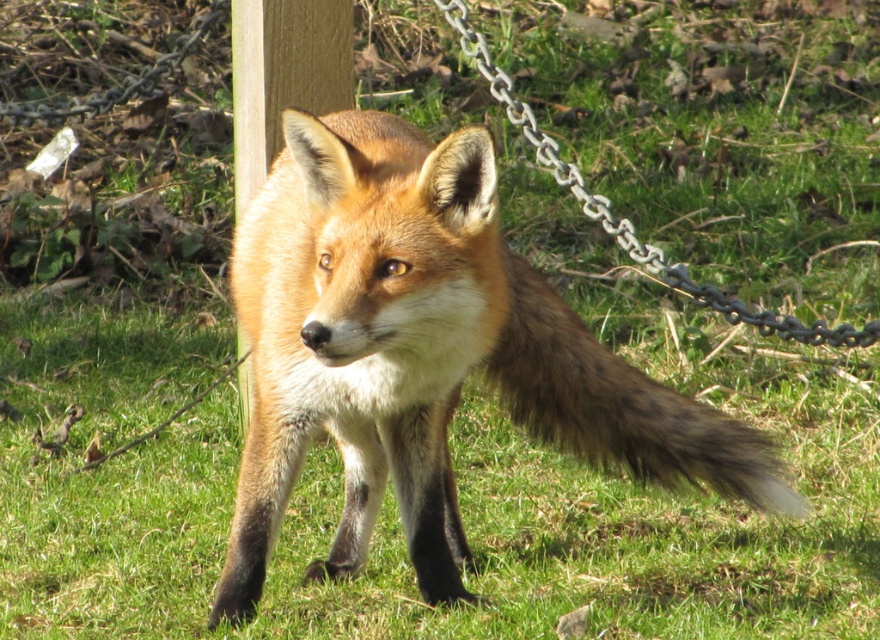
You are a park ranger trying to secure an area with a wooden post and a metallic silver chain. Based on the scene, which object is closer to you, the wooden post at center or the metallic silver chain at upper center?

The wooden post at center is closer to you because the metallic silver chain at upper center is positioned behind it.

You are a wildlife photographer trying to capture a photo of the shiny orange fur fox at center and the brown fuzzy tail at center. Which object should you focus on if you want to ensure both are fully visible in your shot?

You should focus on the shiny orange fur fox at center because it is wider than the brown fuzzy tail at center, ensuring both will fit within the frame.